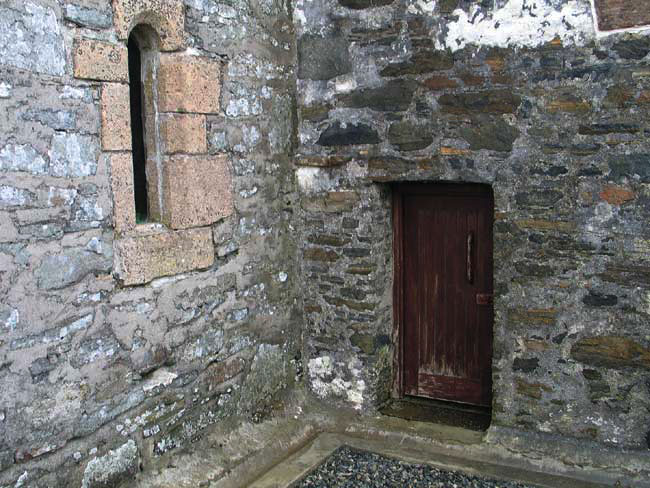
What are the coordinates of `door` in the screenshot? It's located at (446, 293).